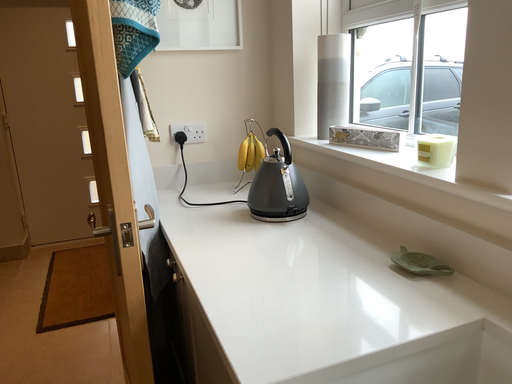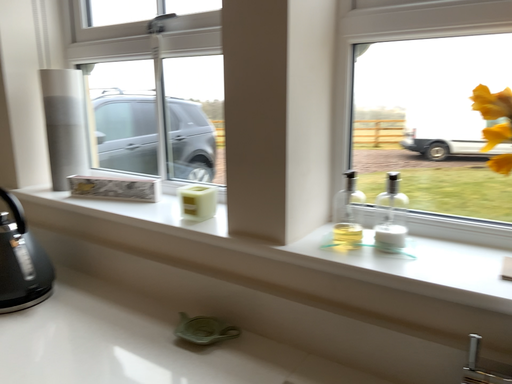
Question: Which way did the camera rotate in the video?

Choices:
 (A) rotated downward
 (B) rotated upward

Answer: (B)